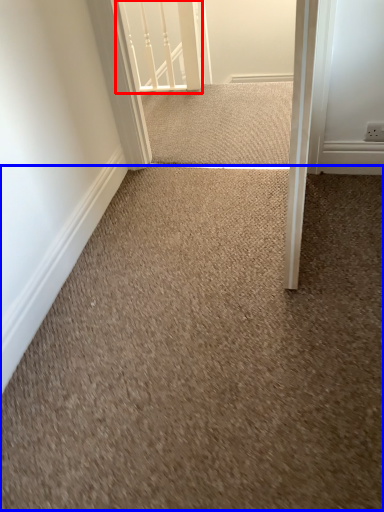
Question: Which object is further to the camera taking this photo, rail (highlighted by a red box) or granite (highlighted by a blue box)?

Choices:
 (A) rail
 (B) granite

Answer: (A)